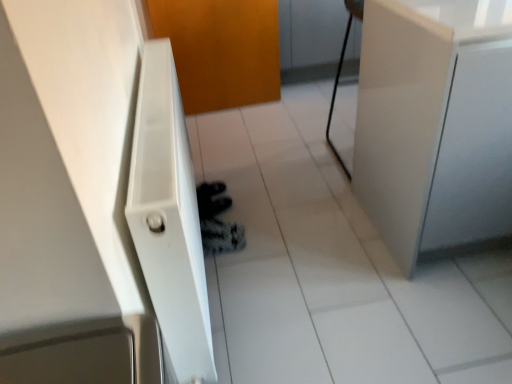
Question: Does white glossy tile at center have a larger size compared to orange matte door at center?

Choices:
 (A) yes
 (B) no

Answer: (A)

Question: From the image's perspective, is white glossy tile at center located above orange matte door at center?

Choices:
 (A) yes
 (B) no

Answer: (B)

Question: Does white glossy tile at center have a greater width compared to orange matte door at center?

Choices:
 (A) no
 (B) yes

Answer: (B)

Question: Is the depth of white glossy tile at center less than that of orange matte door at center?

Choices:
 (A) yes
 (B) no

Answer: (A)

Question: Is orange matte door at center located within white glossy tile at center?

Choices:
 (A) no
 (B) yes

Answer: (A)

Question: Considering the positions of orange matte door at center and white textured radiator at left in the image, is orange matte door at center wider or thinner than white textured radiator at left?

Choices:
 (A) thin
 (B) wide

Answer: (A)

Question: Based on their positions, is orange matte door at center located to the left or right of white textured radiator at left?

Choices:
 (A) left
 (B) right

Answer: (B)

Question: From the image's perspective, is orange matte door at center located above or below white textured radiator at left?

Choices:
 (A) below
 (B) above

Answer: (B)

Question: In terms of size, does orange matte door at center appear bigger or smaller than white textured radiator at left?

Choices:
 (A) big
 (B) small

Answer: (B)

Question: From the image's perspective, relative to orange matte door at center, is white glossy cabinet at right above or below?

Choices:
 (A) above
 (B) below

Answer: (B)

Question: Is white glossy cabinet at right bigger or smaller than orange matte door at center?

Choices:
 (A) big
 (B) small

Answer: (A)

Question: From a real-world perspective, is white glossy cabinet at right above or below orange matte door at center?

Choices:
 (A) above
 (B) below

Answer: (A)

Question: Is point (385, 175) positioned closer to the camera than point (233, 11)?

Choices:
 (A) closer
 (B) farther

Answer: (A)

Question: Considering the positions of white glossy cabinet at right and white glossy tile at center in the image, is white glossy cabinet at right wider or thinner than white glossy tile at center?

Choices:
 (A) wide
 (B) thin

Answer: (B)

Question: Is white glossy cabinet at right in front of or behind white glossy tile at center in the image?

Choices:
 (A) behind
 (B) front

Answer: (B)